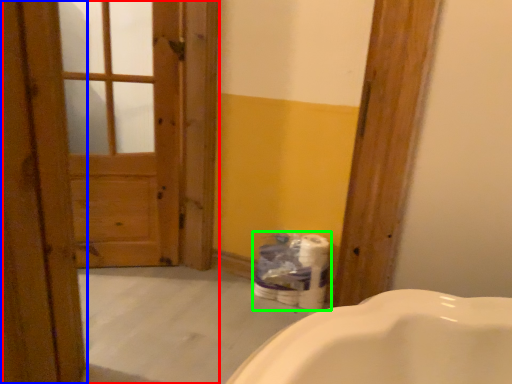
Question: Which object is positioned closest to barn door (highlighted by a red box)? Select from door (highlighted by a blue box) and toilet paper (highlighted by a green box).

Choices:
 (A) door
 (B) toilet paper

Answer: (B)